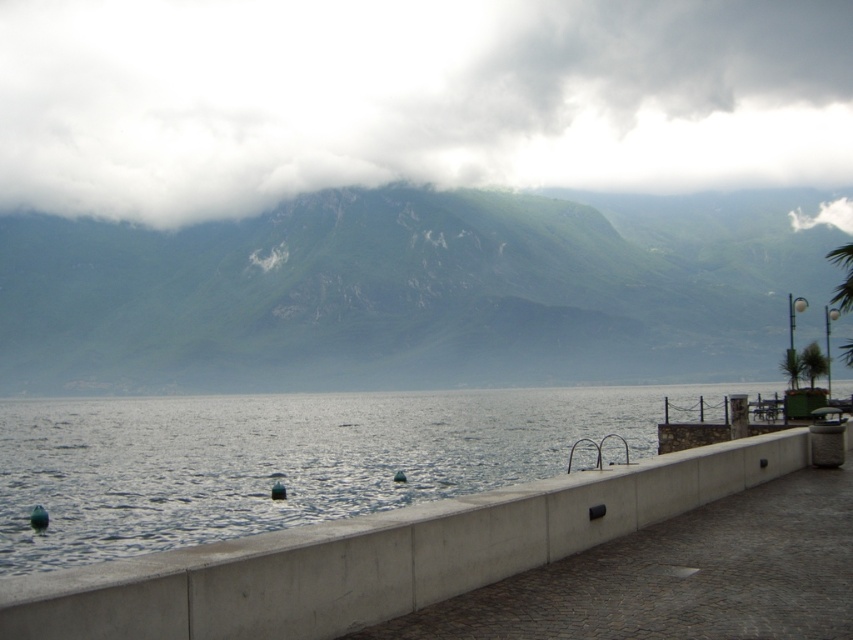
You are standing at the edge of the lakeside and want to place a small green buoy exactly where the concrete at center is located. Is this possible?

The concrete at center is located at point (380, 554), so placing the buoy there would not be possible since the concrete is a solid structure and the buoy floats on water.

You are standing on the lakeside walkway and want to move towards the green leafy palm tree at right. Which direction should you turn to face the concrete at center first before proceeding?

You should turn to your left to face the concrete at center first, as it is located to the left of the green leafy palm tree at right. After reaching the concrete at center, continue moving forward towards the palm tree.

You are an artist planning to paint the lakeside scene. You need to decide which object to paint first based on their sizes. Which one should you start with, the white fluffy cloud at upper center or the green leafy palm tree at right?

The white fluffy cloud at upper center has a larger width than the green leafy palm tree at right, so you should start painting the white fluffy cloud at upper center first because it is bigger in size.